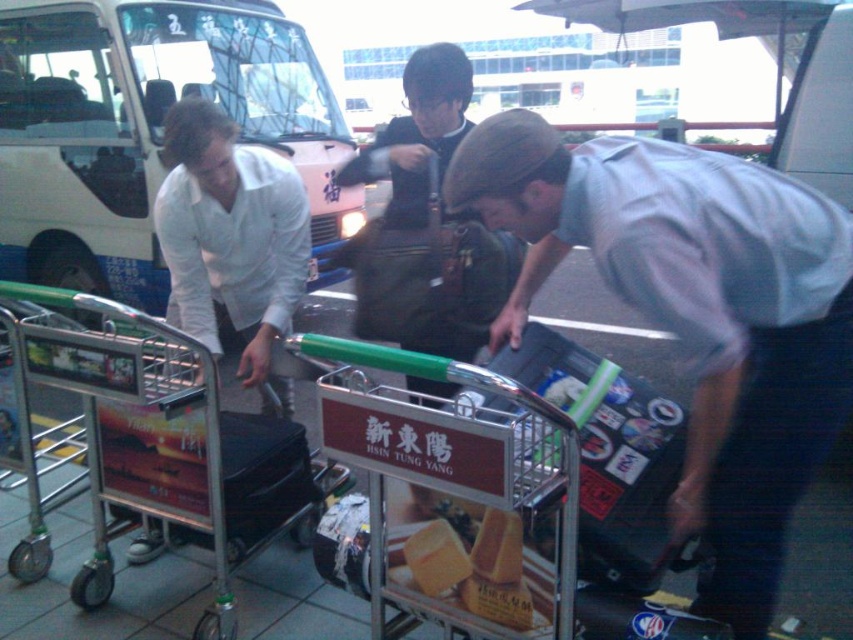
Does pink matte bus at upper left have a greater height compared to yellow matte bread at center?

Correct, pink matte bus at upper left is much taller as yellow matte bread at center.

Is point (45, 12) positioned behind point (485, 509)?

Yes, it is behind point (485, 509).

Is point (335, 193) positioned in front of point (498, 577)?

No, it is not.

This screenshot has width=853, height=640. I want to click on pink matte bus at upper left, so click(x=146, y=131).

Is metallic silver trolley at center bigger than yellow sponge cake at center?

Yes.

Is metallic silver trolley at center to the right of yellow sponge cake at center from the viewer's perspective?

In fact, metallic silver trolley at center is to the left of yellow sponge cake at center.

Locate an element on the screen. metallic silver trolley at center is located at coordinates (164, 440).

Where is `metallic silver trolley at center`? The width and height of the screenshot is (853, 640). metallic silver trolley at center is located at coordinates (164, 440).

Between matte gray shirt at center and yellow matte bread at center, which one is positioned lower?

yellow matte bread at center

Does matte gray shirt at center have a lesser height compared to yellow matte bread at center?

No.

Does point (512, 125) come behind point (492, 577)?

No, it is in front of (492, 577).

Where is `matte gray shirt at center`? matte gray shirt at center is located at coordinates (694, 314).